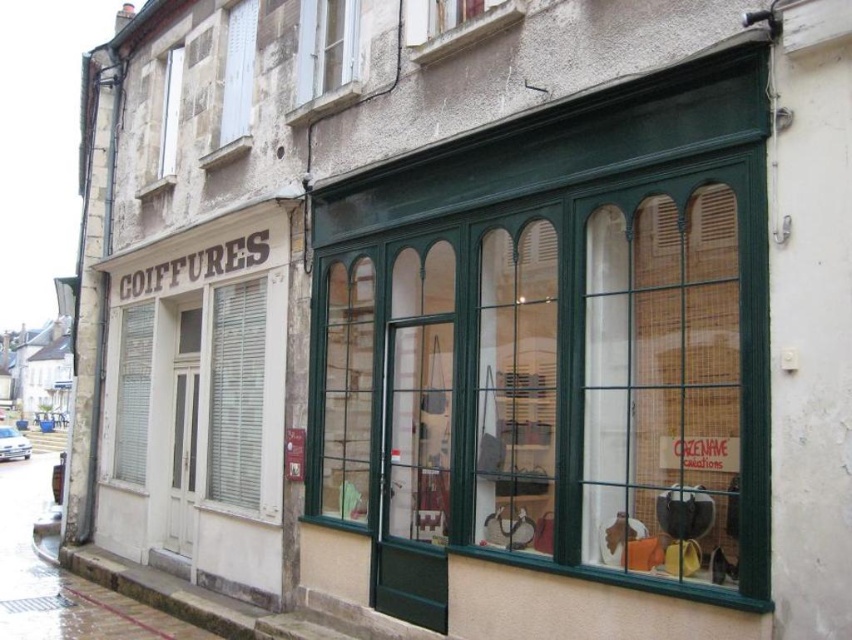
You are a customer standing on the sidewalk in front of the building. You want to look through the white wooden window at upper center and the clear glass window at upper left. Which window can you see more clearly?

The clear glass window at upper left is made of clear glass, so you can see through it more clearly than the white wooden window at upper center, which has wooden frames that may obstruct the view.

You are standing on the sidewalk in front of the building and notice two windows above the shop entrance. Which window, the white wooden window at upper center or the clear glass window at upper left, is located to the right of the other?

The white wooden window at upper center is positioned on the right side of clear glass window at upper left.

You are a customer looking to enter the shop on the ground floor. You notice the white wooden shutter at upper left and the clear glass window at upper left. Which object is located above the other?

The white wooden shutter at upper left is positioned over the clear glass window at upper left, so the shutter is above the window.